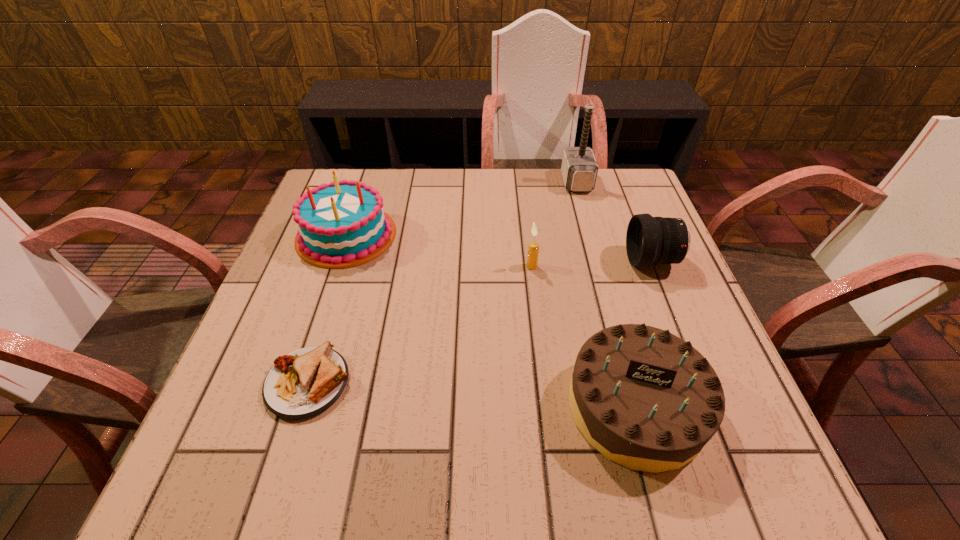
Locate an element on the screen. The width and height of the screenshot is (960, 540). free space between the sandwich and the farthest object is located at coordinates (443, 283).

Find the location of a particular element. This screenshot has height=540, width=960. empty space between the second tallest object and the telephoto lens is located at coordinates (499, 248).

What are the coordinates of `free area in between the fourth object from right to left and the telephoto lens` in the screenshot? It's located at (592, 264).

Choose which object is the fifth nearest neighbor to the taller birthday cake. Please provide its 2D coordinates. Your answer should be formatted as a tuple, i.e. [(x, y)], where the tuple contains the x and y coordinates of a point satisfying the conditions above.

[(650, 240)]

Select which object is the second closest to the second tallest object. Please provide its 2D coordinates. Your answer should be formatted as a tuple, i.e. [(x, y)], where the tuple contains the x and y coordinates of a point satisfying the conditions above.

[(533, 250)]

Identify the location of free space that satisfies the following two spatial constraints: 1. for striking with the head of the farthest object; 2. on the front-facing side of the right birthday cake. Image resolution: width=960 pixels, height=540 pixels. (639, 406).

At what (x,y) coordinates should I click in order to perform the action: click on free space that satisfies the following two spatial constraints: 1. for striking with the head of the tallest object; 2. on the front side of the shortest object. Please return your answer as a coordinate pair (x, y). Looking at the image, I should click on (633, 383).